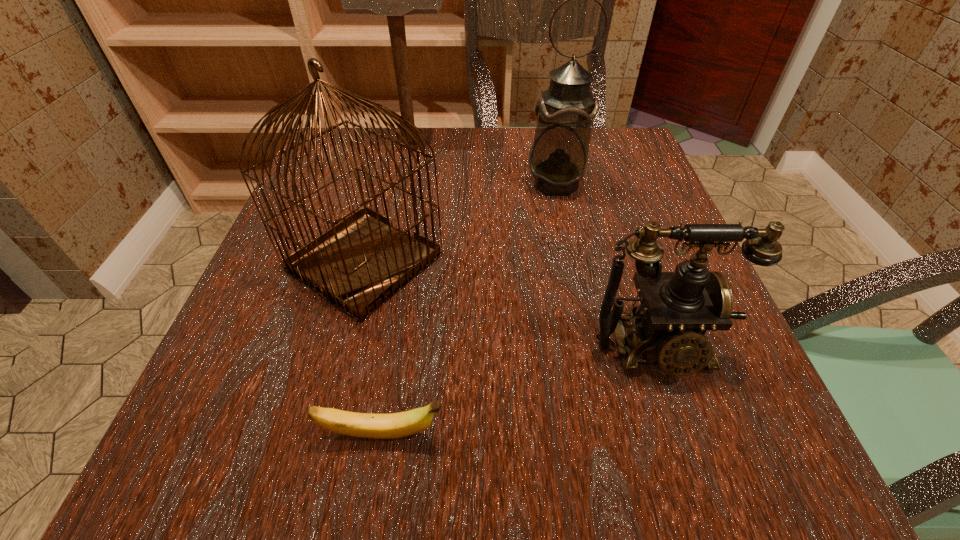
Find the location of `mallet`. mallet is located at coordinates (394, 0).

The height and width of the screenshot is (540, 960). I want to click on the fourth nearest object, so click(558, 159).

This screenshot has width=960, height=540. What are the coordinates of `birdcage` in the screenshot? It's located at (361, 262).

Where is `telephone`? telephone is located at coordinates (677, 308).

Identify the location of the nearest object. (366, 425).

This screenshot has height=540, width=960. Find the location of `the shortest object`. the shortest object is located at coordinates (366, 425).

Identify the location of vacant space located 0.300m on the striking face of the farthest object. (574, 140).

In order to click on vacant space located on the left of the fourth nearest object in this screenshot , I will do `click(357, 184)`.

Where is `blank space located on the right of the birdcage`? blank space located on the right of the birdcage is located at coordinates (620, 262).

What are the coordinates of `free space located on the rotary dial of the second shortest object` in the screenshot? It's located at (694, 463).